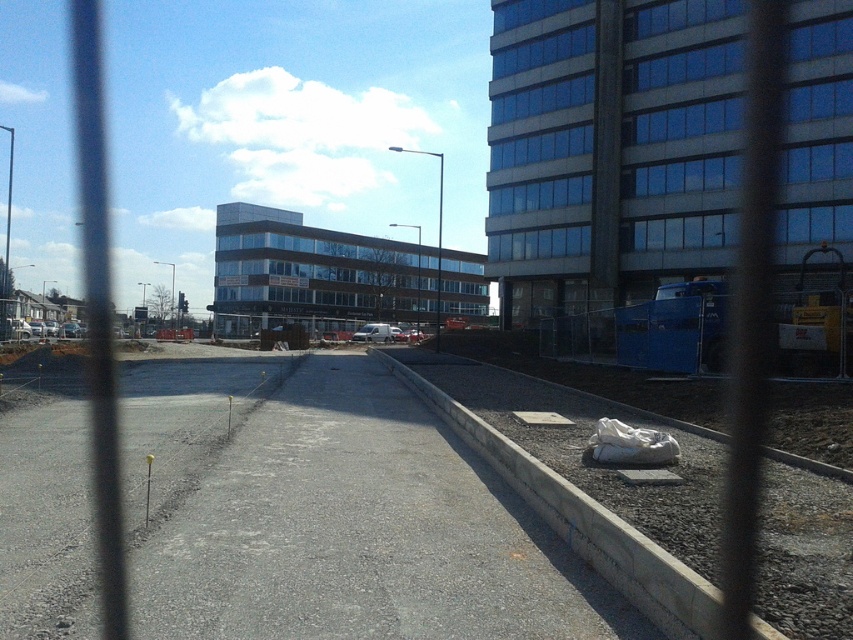
Does glassy blue building at upper right have a greater height compared to glassy brown building at center?

Correct, glassy blue building at upper right is much taller as glassy brown building at center.

You are a GUI agent. You are given a task and a screenshot of the screen. Output one action in this format:
    pyautogui.click(x=<x>, y=<y>)
    Task: Click on the glassy blue building at upper right
    The width and height of the screenshot is (853, 640).
    Given the screenshot: What is the action you would take?
    pyautogui.click(x=610, y=150)

Based on the photo, between concrete at right and glassy brown building at center, which one has more height?

With more height is glassy brown building at center.

Is concrete at right to the right of glassy brown building at center from the viewer's perspective?

Indeed, concrete at right is positioned on the right side of glassy brown building at center.

Does point (770, 509) come closer to viewer compared to point (318, 326)?

That is True.

Image resolution: width=853 pixels, height=640 pixels. I want to click on concrete at right, so click(x=592, y=461).

Does glassy blue building at upper right have a greater height compared to concrete at right?

Yes.

Between glassy blue building at upper right and concrete at right, which one appears on the left side from the viewer's perspective?

Positioned to the left is concrete at right.

Image resolution: width=853 pixels, height=640 pixels. What do you see at coordinates (610, 150) in the screenshot?
I see `glassy blue building at upper right` at bounding box center [610, 150].

This screenshot has width=853, height=640. What are the coordinates of `glassy blue building at upper right` in the screenshot? It's located at (610, 150).